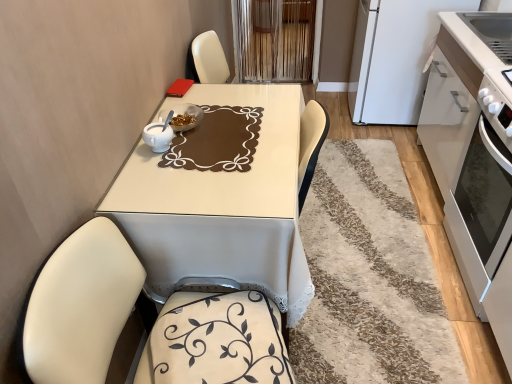
What do you see at coordinates (81, 305) in the screenshot? I see `white fabric swivel chair at lower left` at bounding box center [81, 305].

Image resolution: width=512 pixels, height=384 pixels. I want to click on white matte cabinet at right, so click(x=472, y=142).

Image resolution: width=512 pixels, height=384 pixels. Describe the element at coordinates (369, 277) in the screenshot. I see `white shaggy rug at center` at that location.

Measure the distance between white glossy bowl at center and camera.

A distance of 4.83 feet exists between white glossy bowl at center and camera.

This screenshot has height=384, width=512. What are the coordinates of `white fabric swivel chair at lower left` in the screenshot? It's located at (81, 305).

Consider the image. Between white shaggy rug at center and white fabric swivel chair at lower left, which one has more height?

Standing taller between the two is white fabric swivel chair at lower left.

Which is correct: white shaggy rug at center is inside white fabric swivel chair at lower left, or outside of it?

white shaggy rug at center is outside white fabric swivel chair at lower left.

Visually, is white shaggy rug at center positioned to the left or to the right of white fabric swivel chair at lower left?

In the image, white shaggy rug at center appears on the right side of white fabric swivel chair at lower left.

Consider the image. Is white glossy oven at right positioned with its back to white fabric swivel chair at lower left?

No, white glossy oven at right is not facing the opposite direction of white fabric swivel chair at lower left.

Measure the distance from white glossy oven at right to white fabric swivel chair at lower left.

1.11 meters.

Which object is more forward, white glossy oven at right or white fabric swivel chair at lower left?

white fabric swivel chair at lower left is more forward.

In terms of size, does white glossy table at center appear bigger or smaller than white matte refrigerator at upper right?

white glossy table at center is bigger than white matte refrigerator at upper right.

Is white glossy table at center further to the viewer compared to white matte refrigerator at upper right?

No, white glossy table at center is closer to the camera.

From a real-world perspective, who is located higher, white glossy table at center or white matte refrigerator at upper right?

From a 3D spatial view, white matte refrigerator at upper right is above.

Can you tell me how much white shaggy rug at center and white glossy table at center differ in facing direction?

They differ by 1.2 degrees in their facing directions.

Is white shaggy rug at center positioned behind white glossy table at center?

Yes, the depth of white shaggy rug at center is greater than that of white glossy table at center.

Where is `mat located below the white glossy table at center (from the image's perspective)`? This screenshot has height=384, width=512. mat located below the white glossy table at center (from the image's perspective) is located at coordinates (369, 277).

From a real-world perspective, who is located lower, white shaggy rug at center or white glossy table at center?

In real-world perspective, white shaggy rug at center is lower.

Between white glossy table at center and white shaggy rug at center, which one appears on the left side from the viewer's perspective?

white glossy table at center.

Can you confirm if white glossy table at center is taller than white shaggy rug at center?

Yes.

From the image's perspective, is white glossy table at center above white shaggy rug at center?

Correct, white glossy table at center appears higher than white shaggy rug at center in the image.

Relative to white shaggy rug at center, is white glossy table at center in front or behind?

In the image, white glossy table at center appears in front of white shaggy rug at center.

Considering the positions of objects white glossy table at center and white fabric swivel chair at lower left in the image provided, who is more to the right, white glossy table at center or white fabric swivel chair at lower left?

Positioned to the right is white glossy table at center.

Which of these two, white glossy table at center or white fabric swivel chair at lower left, is smaller?

With smaller size is white fabric swivel chair at lower left.

Could you tell me if white glossy table at center is turned towards white fabric swivel chair at lower left?

No, white glossy table at center is not turned towards white fabric swivel chair at lower left.

Is point (395, 279) closer to viewer compared to point (149, 144)?

No, it is behind (149, 144).

Is white shaggy rug at center to the left of white glossy bowl at center from the viewer's perspective?

No.

Is white shaggy rug at center beside white glossy bowl at center?

white shaggy rug at center is not next to white glossy bowl at center, and they're not touching.

Is white shaggy rug at center bigger than white glossy bowl at center?

Correct, white shaggy rug at center is larger in size than white glossy bowl at center.

The image size is (512, 384). I want to click on mat behind the white fabric swivel chair at lower left, so click(369, 277).

This screenshot has height=384, width=512. Identify the location of oven on the right of the white fabric swivel chair at lower left. (481, 212).

Based on their spatial positions, is white glossy oven at right or white matte cabinet at right further from white shaggy rug at center?

Among the two, white matte cabinet at right is located further to white shaggy rug at center.

Looking at the image, which one is located closer to white glossy bowl at center, white glossy table at center or white matte cabinet at right?

white glossy table at center is positioned closer to the anchor white glossy bowl at center.

Considering their positions, is white matte refrigerator at upper right positioned further to white glossy table at center than white glossy oven at right?

white matte refrigerator at upper right is positioned further to the anchor white glossy table at center.

From the image, which object appears to be farther from white glossy bowl at center, white matte refrigerator at upper right or white glossy oven at right?

The object further to white glossy bowl at center is white matte refrigerator at upper right.

Considering their positions, is white glossy oven at right positioned further to white shaggy rug at center than white fabric swivel chair at lower left?

white fabric swivel chair at lower left.

From the image, which object appears to be nearer to white glossy oven at right, white glossy table at center or white fabric swivel chair at lower left?

white glossy table at center.

Looking at the image, which one is located further to white fabric swivel chair at lower left, white matte cabinet at right or white glossy oven at right?

Based on the image, white matte cabinet at right appears to be further to white fabric swivel chair at lower left.

When comparing their distances from white shaggy rug at center, does white glossy table at center or white matte cabinet at right seem further?

white glossy table at center.

What are the coordinates of `mat located between white glossy table at center and white glossy oven at right in the left-right direction` in the screenshot? It's located at (369, 277).

Find the location of a particular element. The height and width of the screenshot is (384, 512). table between white fabric swivel chair at lower left and white glossy oven at right is located at coordinates (x=223, y=204).

At what (x,y) coordinates should I click in order to perform the action: click on oven situated between white glossy table at center and white matte cabinet at right from left to right. Please return your answer as a coordinate pair (x, y). This screenshot has width=512, height=384. Looking at the image, I should click on (481, 212).

Find the location of `appliance between white glossy bowl at center and white matte cabinet at right`. appliance between white glossy bowl at center and white matte cabinet at right is located at coordinates (394, 57).